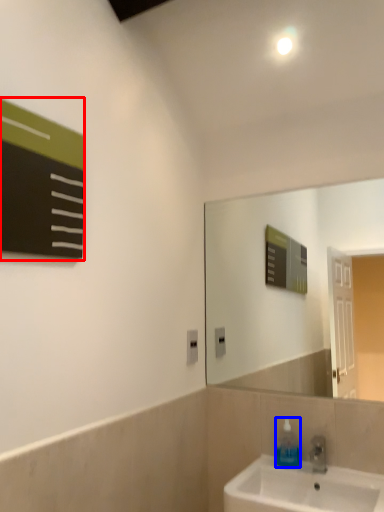
Question: Which of the following is the farthest to the observer, bulletin board (highlighted by a red box) or soap dispenser (highlighted by a blue box)?

Choices:
 (A) bulletin board
 (B) soap dispenser

Answer: (B)